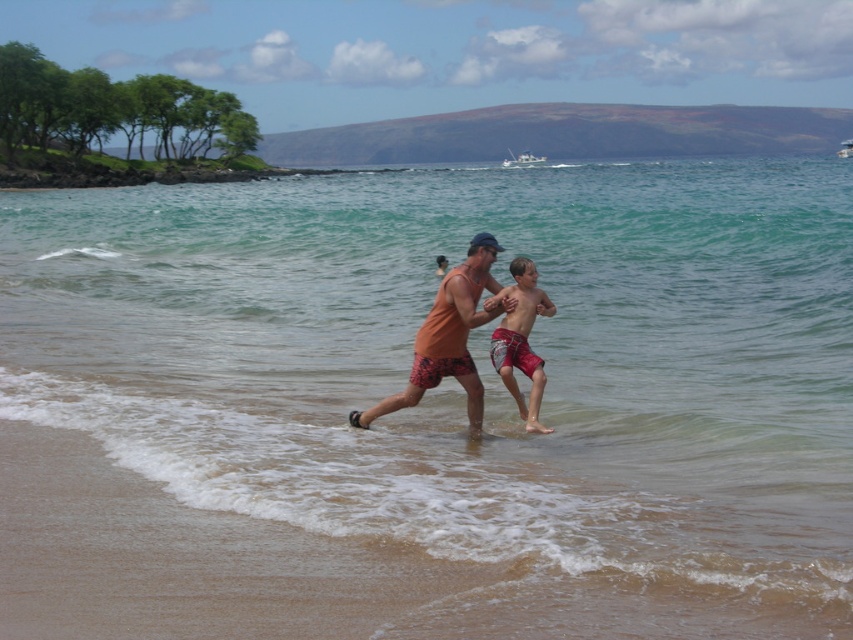
Question: Is orange cotton tank top at center below red plaid shorts at center?

Choices:
 (A) no
 (B) yes

Answer: (A)

Question: Considering the relative positions of orange cotton tank top at center and red plaid shorts at center in the image provided, where is orange cotton tank top at center located with respect to red plaid shorts at center?

Choices:
 (A) left
 (B) right

Answer: (A)

Question: Does orange cotton tank top at center have a lesser width compared to red plaid shorts at center?

Choices:
 (A) no
 (B) yes

Answer: (A)

Question: Which point is farther to the camera?

Choices:
 (A) red plaid shorts at center
 (B) orange cotton tank top at center

Answer: (A)